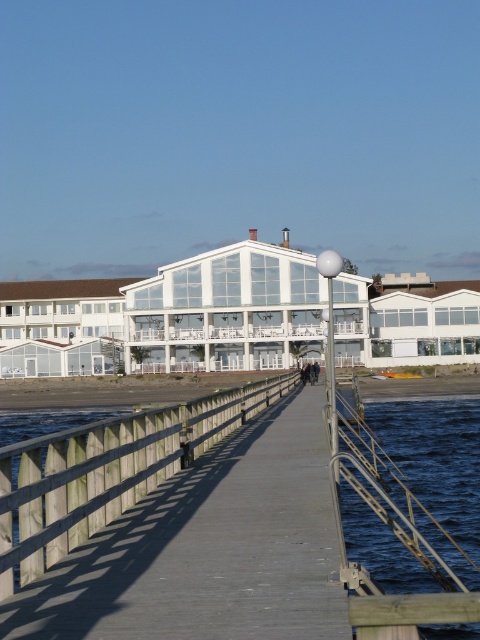
You are standing at the wooden pier in the waterfront scene. You see a point marked at coordinates (424, 468). Based on the scene description, where is this point located?

The point (424, 468) is on the blue water at lower right.

You are standing on the wooden pier and notice two objects at the center of your view. One is labeled as wooden at center and the other as dark blue jeans at center. Which object is closer to you?

The wooden at center is positioned over dark blue jeans at center, meaning it is closer to you.

You are standing on the wooden pier and want to jump into the blue water at lower right. Your dark blue jeans at center are currently 24.74 meters away from the water. Is there enough space between your jeans and the water to safely run and jump?

The distance between the blue water at lower right and dark blue jeans at center is 24.74 meters, which provides sufficient space to safely run and jump into the water.